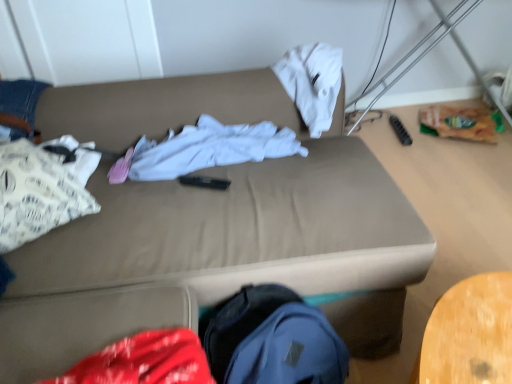
Question: From the image's perspective, is white paper bag at left, arranged as the 2th clothing when viewed from the right, located above or below beige fabric couch at center?

Choices:
 (A) below
 (B) above

Answer: (B)

Question: Is white paper bag at left, arranged as the 2th clothing when viewed from the right, inside or outside of beige fabric couch at center?

Choices:
 (A) inside
 (B) outside

Answer: (A)

Question: Which of these objects is positioned closest to the white paper bag at left, which is the first clothing in left-to-right order?

Choices:
 (A) beige fabric couch at center
 (B) white cotton shirt at center, which is the second clothing from left to right

Answer: (A)

Question: Which of these objects is positioned closest to the white paper bag at left, which is the first clothing in left-to-right order?

Choices:
 (A) white cotton shirt at center, which is the second clothing from left to right
 (B) beige fabric couch at center

Answer: (B)